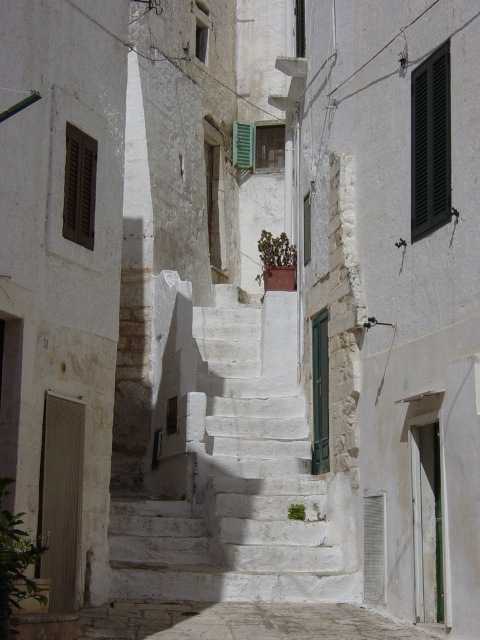
Question: Which object is farther from the camera taking this photo?

Choices:
 (A) green leafy plant at center
 (B) black matte shutters at upper right

Answer: (A)

Question: Is green leafy plant at lower left above brown wooden shutter at upper left?

Choices:
 (A) no
 (B) yes

Answer: (A)

Question: In this image, where is brown matte door at lower left located relative to green leafy plant at center?

Choices:
 (A) right
 (B) left

Answer: (B)

Question: Among these objects, which one is nearest to the camera?

Choices:
 (A) green matte door at center
 (B) black matte shutters at upper right
 (C) green leafy plant at center
 (D) brown matte door at lower left

Answer: (D)

Question: Does brown matte door at lower left have a lesser width compared to green matte door at center?

Choices:
 (A) no
 (B) yes

Answer: (A)

Question: Considering the real-world distances, which object is closest to the green matte door at center?

Choices:
 (A) black matte shutters at upper right
 (B) green leafy plant at lower left
 (C) green matte plant at center

Answer: (C)